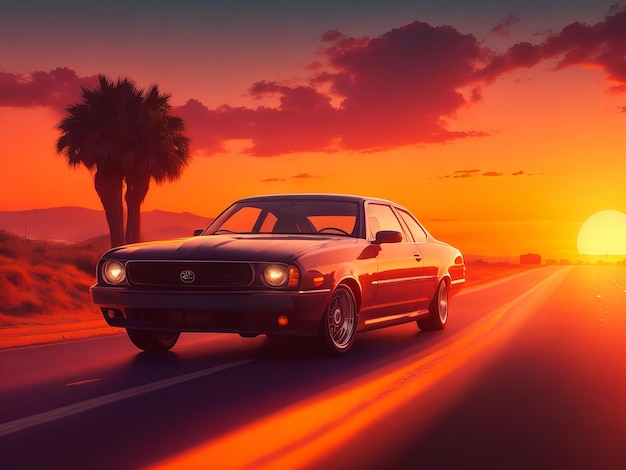
Image resolution: width=626 pixels, height=470 pixels. In order to click on right mirror in this screenshot , I will do `click(197, 231)`.